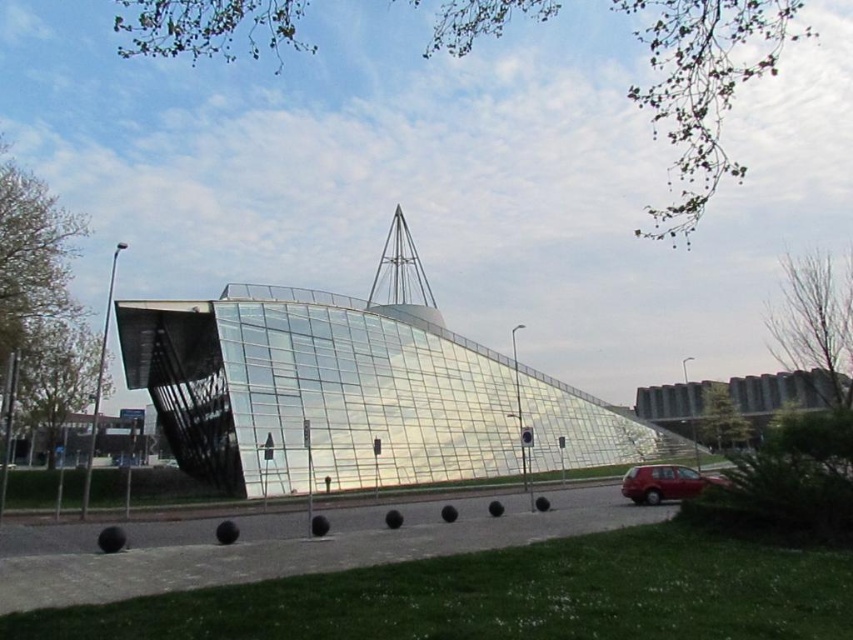
Is point (425, 412) farther from viewer compared to point (409, 230)?

That is False.

Does transparent glass building at center have a lesser width compared to transparent glass pyramid at center?

Incorrect, transparent glass building at center's width is not less than transparent glass pyramid at center's.

Who is more forward, (412, 305) or (422, 294)?

Point (412, 305) is more forward.

Where is `transparent glass building at center`? This screenshot has width=853, height=640. transparent glass building at center is located at coordinates (355, 390).

Is transparent glass building at center closer to camera compared to shiny red car at lower right?

No, transparent glass building at center is behind shiny red car at lower right.

Can you confirm if transparent glass building at center is taller than shiny red car at lower right?

Yes, transparent glass building at center is taller than shiny red car at lower right.

Is point (386, 339) more distant than point (641, 477)?

That is True.

Identify the location of transparent glass building at center. (355, 390).

Based on the photo, can you confirm if transparent glass pyramid at center is smaller than shiny red car at lower right?

Incorrect, transparent glass pyramid at center is not smaller in size than shiny red car at lower right.

Who is more distant from viewer, (390, 301) or (670, 488)?

The point (390, 301) is behind.

Where is `transparent glass pyramid at center`? Image resolution: width=853 pixels, height=640 pixels. transparent glass pyramid at center is located at coordinates (402, 275).